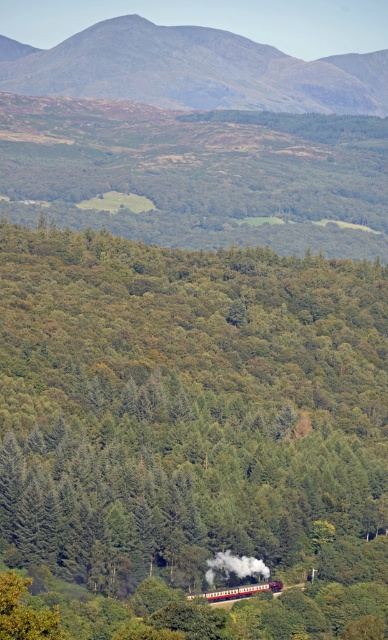
Question: Where is rugged brown mountain at upper center located in relation to polished brass steam at lower center in the image?

Choices:
 (A) right
 (B) left

Answer: (B)

Question: Which of these objects is positioned closest to the polished brass steam at lower center?

Choices:
 (A) rugged brown mountain at upper center
 (B) red polished wood passenger train at center

Answer: (B)

Question: Which object is positioned farthest from the polished brass steam at lower center?

Choices:
 (A) red polished wood passenger train at center
 (B) rugged brown mountain at upper center

Answer: (B)

Question: Is rugged brown mountain at upper center above polished brass steam at lower center?

Choices:
 (A) yes
 (B) no

Answer: (A)

Question: Can you confirm if rugged brown mountain at upper center is positioned to the left of polished brass steam at lower center?

Choices:
 (A) yes
 (B) no

Answer: (A)

Question: Estimate the real-world distances between objects in this image. Which object is farther from the polished brass steam at lower center?

Choices:
 (A) rugged brown mountain at upper center
 (B) red polished wood passenger train at center

Answer: (A)